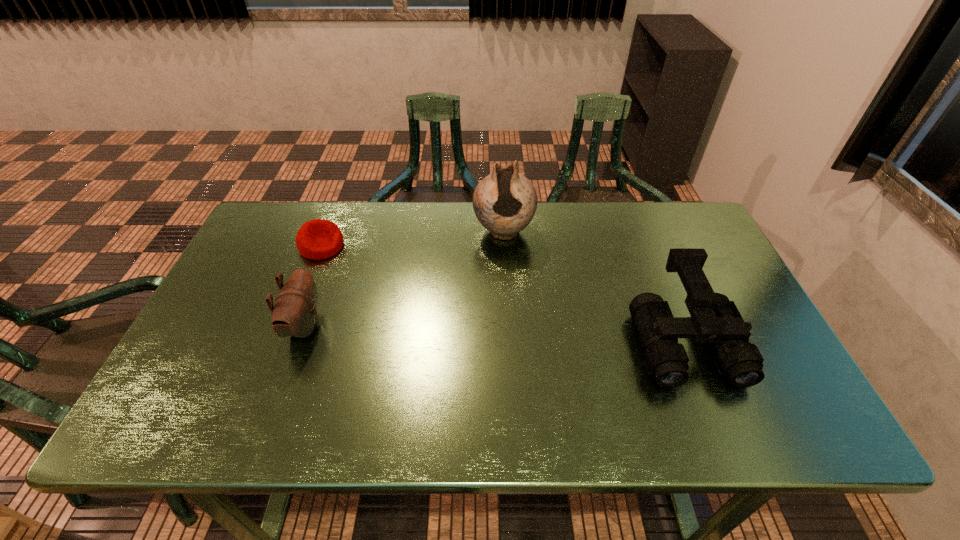
I want to click on vacant spot on the desktop that is between the second shortest object and the binoculars and is positioned from the spout of the second object from right to left, so [x=503, y=333].

Identify the location of vacant space on the desktop that is between the pouch and the second tallest object and is positioned on the seat area of the beanbag. Image resolution: width=960 pixels, height=540 pixels. (480, 332).